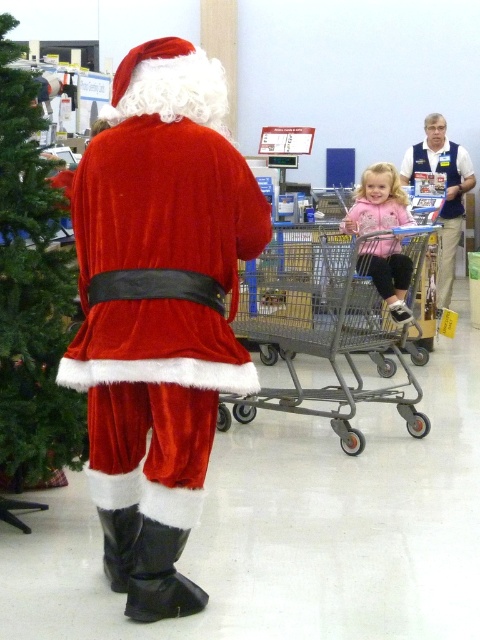
Does metallic gray shopping cart at right appear over pink fleece jacket at center?

Incorrect, metallic gray shopping cart at right is not positioned above pink fleece jacket at center.

Which is more to the left, metallic gray shopping cart at right or pink fleece jacket at center?

Positioned to the left is metallic gray shopping cart at right.

Image resolution: width=480 pixels, height=640 pixels. What are the coordinates of `metallic gray shopping cart at right` in the screenshot? It's located at (320, 328).

Is point (167, 77) in front of point (313, 305)?

Yes, it is in front of point (313, 305).

What do you see at coordinates (158, 310) in the screenshot?
I see `velvet santa claus at center` at bounding box center [158, 310].

What do you see at coordinates (158, 310) in the screenshot? I see `velvet santa claus at center` at bounding box center [158, 310].

This screenshot has height=640, width=480. What are the coordinates of `velvet santa claus at center` in the screenshot? It's located at (158, 310).

Is point (108, 573) positioned behind point (386, 196)?

No, (108, 573) is closer to viewer.

Does velvet santa claus at center appear under pink fleece jacket at center?

Correct, velvet santa claus at center is located below pink fleece jacket at center.

Image resolution: width=480 pixels, height=640 pixels. What are the coordinates of `velvet santa claus at center` in the screenshot? It's located at tap(158, 310).